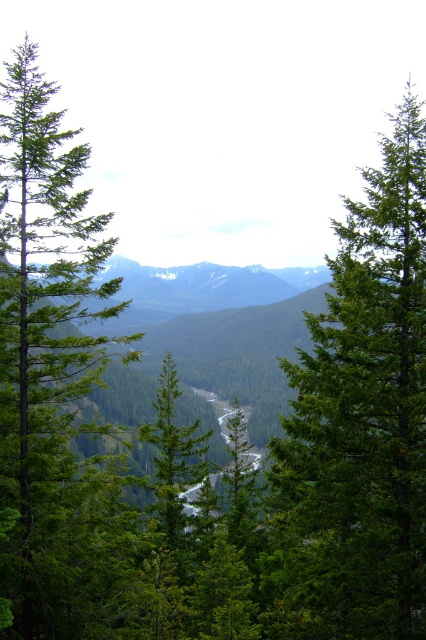
You are standing in the valley and want to climb the tallest tree between the green matte tree at center and the green matte tree at left. Which tree should you choose?

The green matte tree at left is taller than the green matte tree at center, so you should choose the green matte tree at left to climb.

You are standing in the valley and see the green matte tree at center and the green matte tree at left. Which tree is positioned to the right of the other?

The green matte tree at center is positioned to the right of the green matte tree at left.